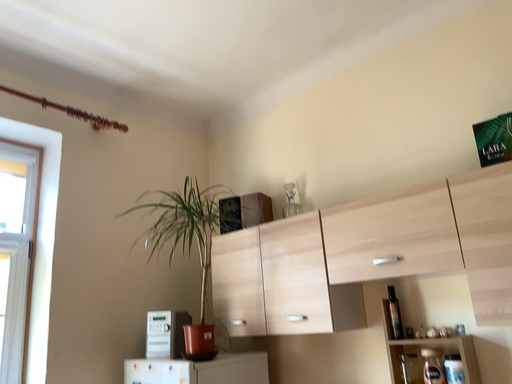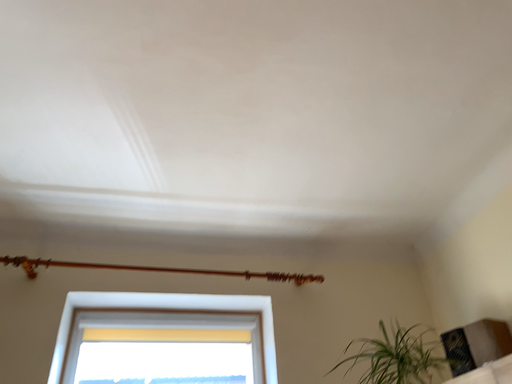
Question: How did the camera likely rotate when shooting the video?

Choices:
 (A) rotated upward
 (B) rotated downward

Answer: (A)